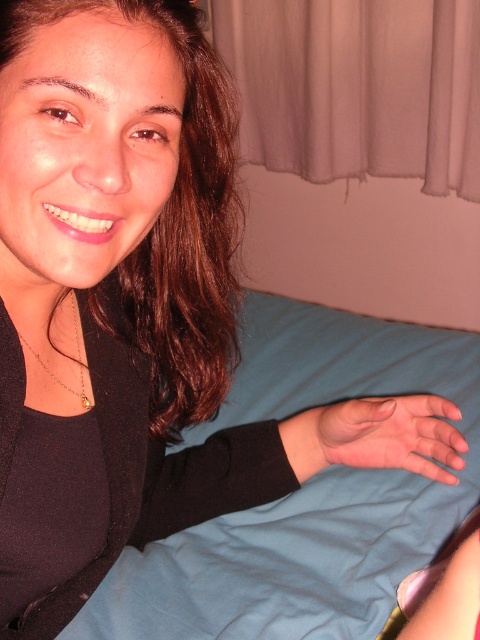
Question: Is pink smooth skin at center further to the viewer compared to gold chain necklace at left?

Choices:
 (A) yes
 (B) no

Answer: (A)

Question: Is pink smooth skin at center wider than gold chain necklace at left?

Choices:
 (A) no
 (B) yes

Answer: (B)

Question: Which object is farther from the camera taking this photo?

Choices:
 (A) pink smooth skin at center
 (B) gold chain necklace at left

Answer: (A)

Question: Can you confirm if blue fabric bed at center is positioned above gold chain necklace at left?

Choices:
 (A) no
 (B) yes

Answer: (A)

Question: Which point appears closest to the camera in this image?

Choices:
 (A) (412, 454)
 (B) (71, 298)
 (C) (393, 500)

Answer: (B)

Question: Estimate the real-world distances between objects in this image. Which object is farther from the gold chain necklace at left?

Choices:
 (A) blue fabric bed at center
 (B) pink smooth skin at center

Answer: (A)